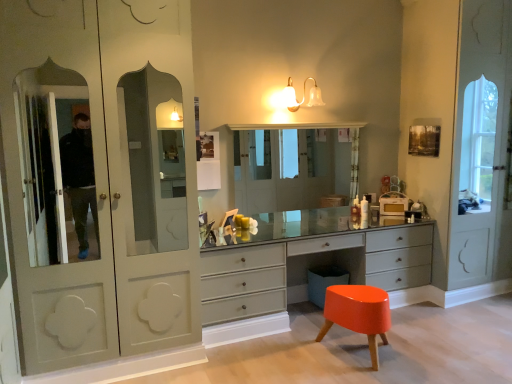
Identify the location of vacant space that is in between matte white wardrobe at left and satin gray dresser at center. The width and height of the screenshot is (512, 384). (261, 346).